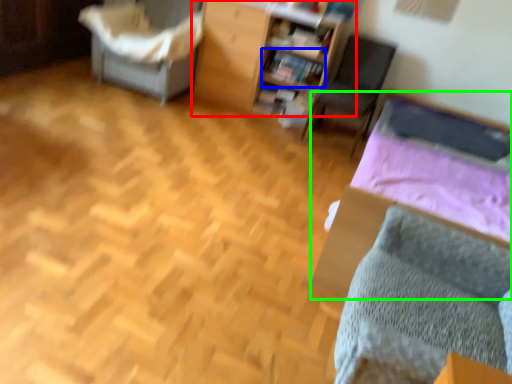
Question: Considering the real-world distances, which object is farthest from furniture (highlighted by a red box)? book (highlighted by a blue box) or bed (highlighted by a green box)?

Choices:
 (A) book
 (B) bed

Answer: (B)